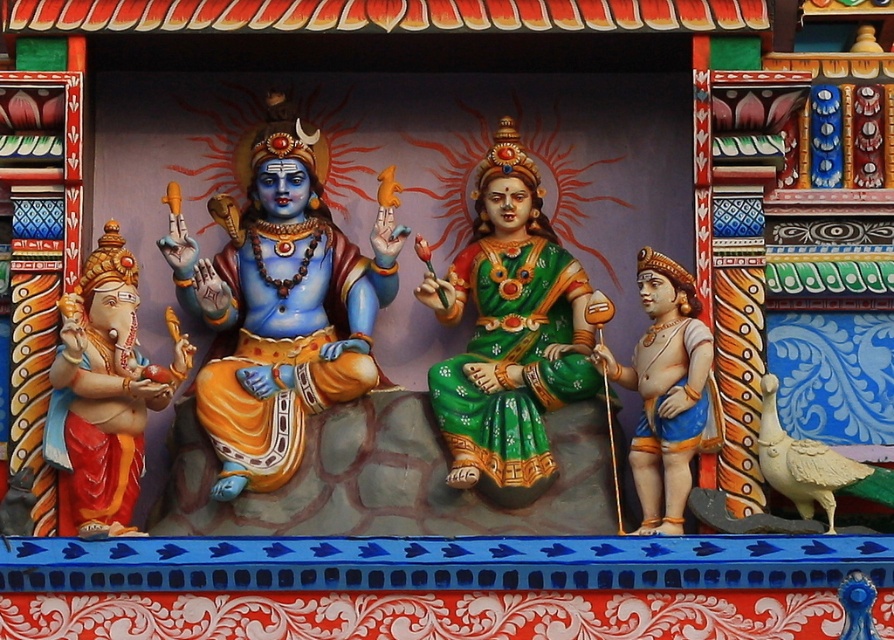
You are a temple visitor standing in front of the religious scene. You notice two points marked in the image. The first point is located at coordinates point (374,241) and the second at point (132,300). Which of these two points is closer to you, the observer?

Point (374,241) is further to the camera than point (132,300), so the point closer to you is point (132,300).

You are standing in front of the religious scene and want to know how far the point at coordinates (167, 264) is from you. Can you determine the distance?

The point at coordinates (167, 264) is 99.73 meters away from the viewer.